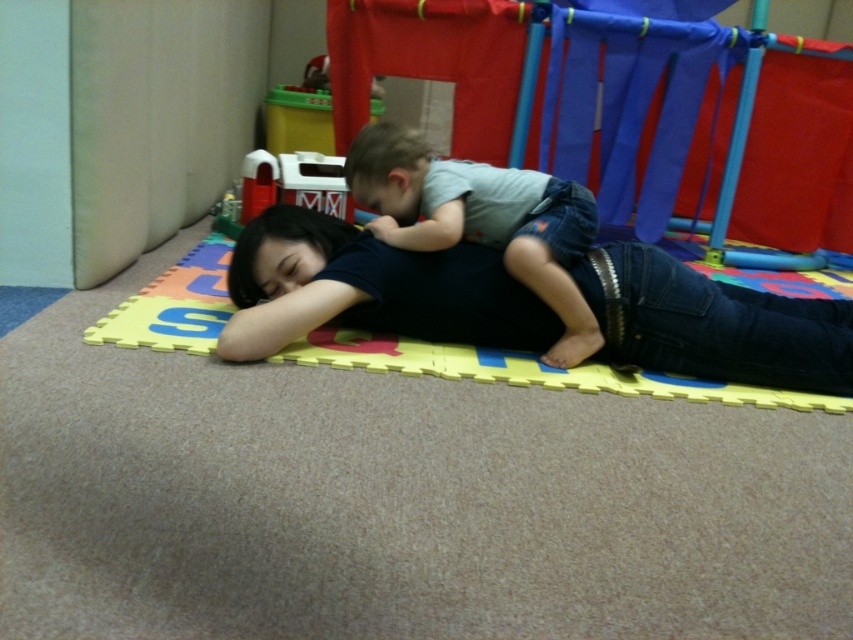
Does yellow foam mat at center appear under white plastic toy at upper center?

Yes, yellow foam mat at center is below white plastic toy at upper center.

Who is more forward, (718,390) or (247,220)?

Point (718,390) is in front.

I want to click on yellow foam mat at center, so [527, 371].

Who is shorter, light gray denim pants at center or white plastic toy at upper center?

white plastic toy at upper center

Based on the photo, does light gray denim pants at center have a greater width compared to white plastic toy at upper center?

Yes, light gray denim pants at center is wider than white plastic toy at upper center.

Image resolution: width=853 pixels, height=640 pixels. In order to click on light gray denim pants at center in this screenshot , I will do `click(480, 220)`.

Measure the distance between point (x=405, y=211) and camera.

They are 6.32 feet apart.

Is point (440, 177) in front of point (183, 284)?

Yes, it is in front of point (183, 284).

Identify the location of light gray denim pants at center. (480, 220).